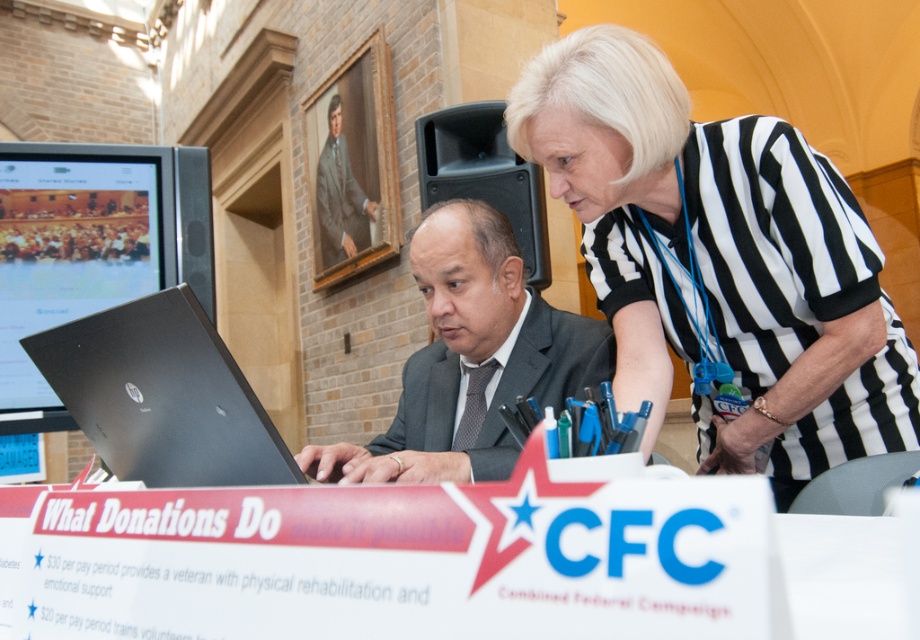
The height and width of the screenshot is (640, 920). What do you see at coordinates (403, 561) in the screenshot?
I see `white paper at center` at bounding box center [403, 561].

Is point (79, 556) in front of point (898, 426)?

That is True.

Find the location of `white paper at center`. white paper at center is located at coordinates (403, 561).

From the picture: Between black and white striped shirt at upper right and brown textured suit at upper center, which one appears on the right side from the viewer's perspective?

From the viewer's perspective, black and white striped shirt at upper right appears more on the right side.

Can you confirm if black and white striped shirt at upper right is shorter than brown textured suit at upper center?

Indeed, black and white striped shirt at upper right has a lesser height compared to brown textured suit at upper center.

Is point (768, 164) positioned in front of point (354, 232)?

Yes, point (768, 164) is closer to viewer.

Find the location of a particular element. The height and width of the screenshot is (640, 920). black and white striped shirt at upper right is located at coordinates (720, 260).

At what (x,y) coordinates should I click in order to perform the action: click on dark gray suit at center. Please return your answer as a coordinate pair (x, y). This screenshot has height=640, width=920. Looking at the image, I should click on (539, 376).

Between point (439, 352) and point (322, 196), which one is positioned in front?

Point (439, 352) is in front.

Identify the location of dark gray suit at center. The image size is (920, 640). (539, 376).

What are the coordinates of `dark gray suit at center` in the screenshot? It's located at (539, 376).